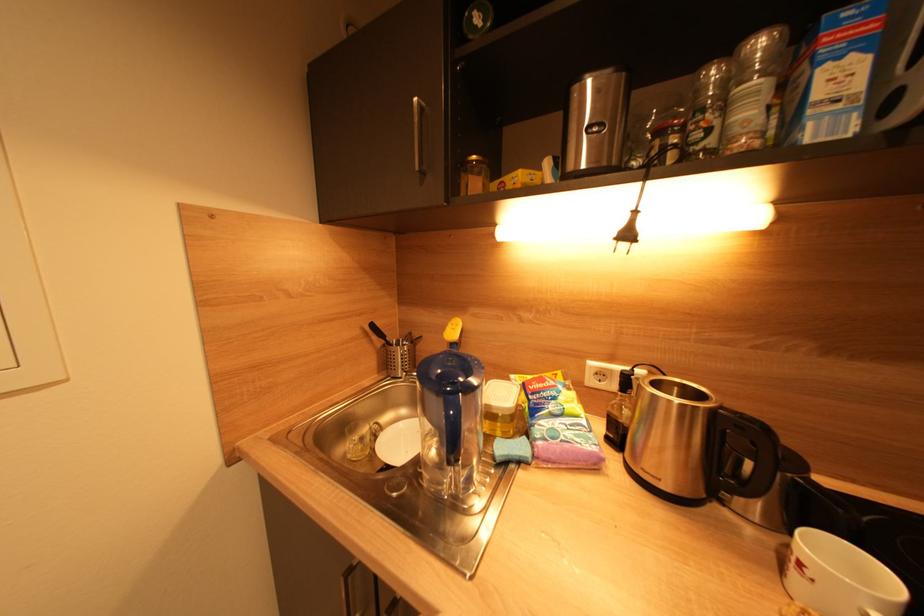
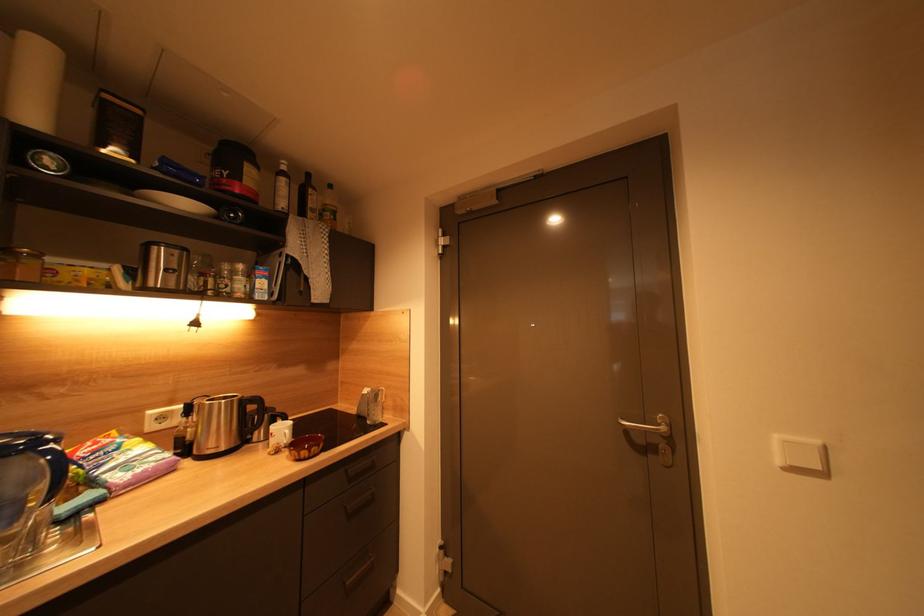
Question: How did the camera likely rotate?

Choices:
 (A) Left
 (B) Right
 (C) Up
 (D) Down

Answer: (B)